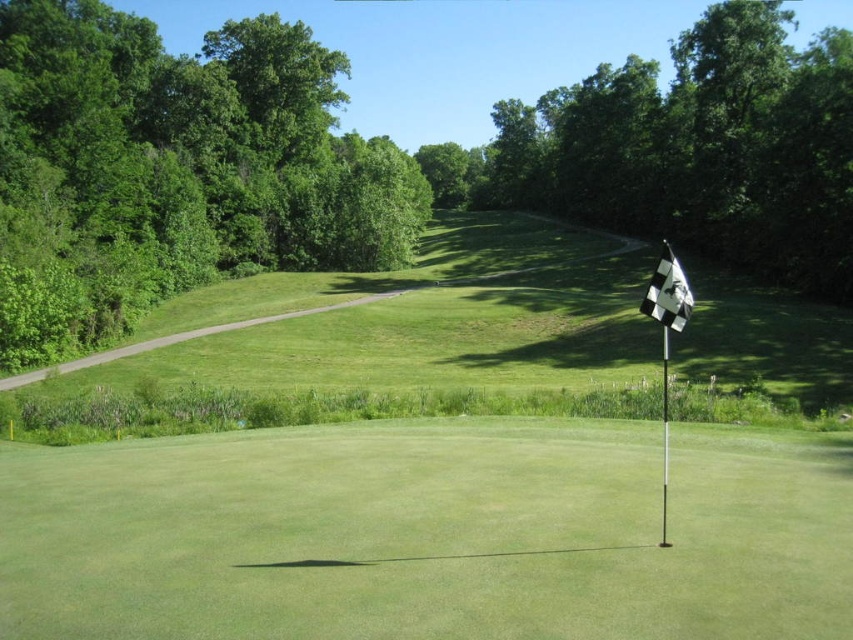
You are standing at the point with coordinates point (660, 316) and want to walk to the point with coordinates point (18, 483). According to the scene description, which direction should you move to reach your destination?

You should move forward because point (18, 483) is behind point (660, 316), meaning it is in the direction you are facing as you look towards the scene.

You are a golfer standing on the putting green and want to hit the ball towards the hole marked by the black checkered flag at right. There are green leafy trees at upper left in your way. Can you see the flag from your current position?

The green leafy trees at upper left are positioned on the left side of the black checkered flag at right, so they are not directly blocking the view of the flag. Therefore, you can see the flag from your current position on the putting green.

You are a golfer trying to determine which flag to aim for. Both the white checkered flag at center and the black checkered flag at right are visible. Which flag is larger?

The black checkered flag at right is larger than the white checkered flag at center.